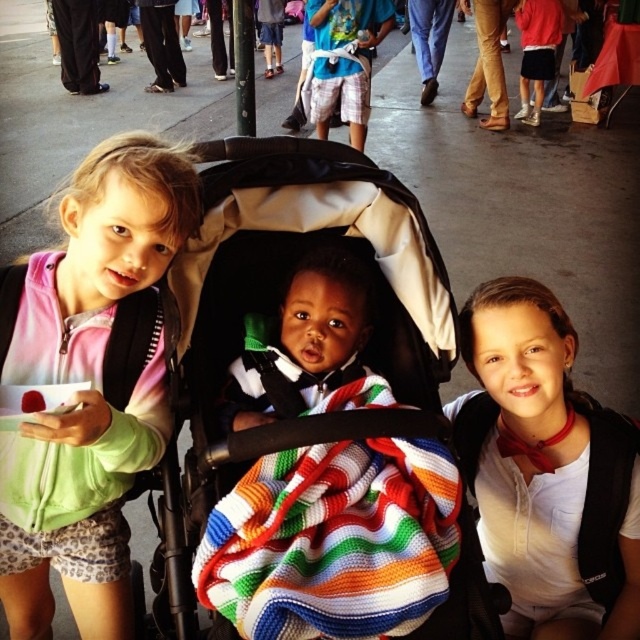
Question: From the image, what is the correct spatial relationship of pink tie-dye hoodie at left in relation to multicolored knitted blanket at center?

Choices:
 (A) below
 (B) above

Answer: (B)

Question: Can you confirm if multicolored knitted blanket at center is positioned to the left of blue t-shirt at center?

Choices:
 (A) yes
 (B) no

Answer: (A)

Question: Which point is farther from the camera taking this photo?

Choices:
 (A) (310, 348)
 (B) (189, 545)

Answer: (A)

Question: Which point appears closest to the camera in this image?

Choices:
 (A) (307, 456)
 (B) (42, 573)

Answer: (A)

Question: Where is pink tie-dye hoodie at left located in relation to blue t-shirt at center in the image?

Choices:
 (A) right
 (B) left

Answer: (B)

Question: Which object is positioned closest to the blue t-shirt at center?

Choices:
 (A) striped knit sweater at center
 (B) multicolored knitted blanket at center
 (C) black fabric baby carriage at center

Answer: (C)